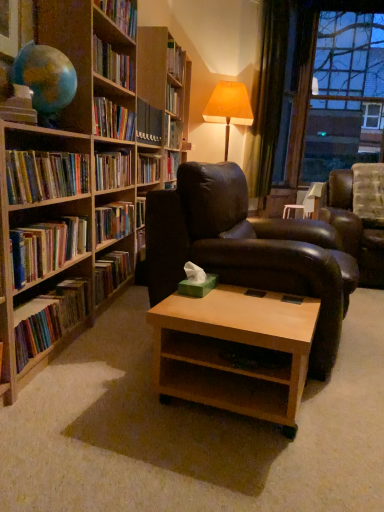
Question: From the image's perspective, is wooden bookshelf at center under hardcover books at left, which is the third book from bottom to top?

Choices:
 (A) no
 (B) yes

Answer: (A)

Question: Is wooden bookshelf at center oriented away from hardcover books at left, the 1th book when ordered from top to bottom?

Choices:
 (A) no
 (B) yes

Answer: (A)

Question: Is wooden bookshelf at center smaller than hardcover books at left, which is the third book from bottom to top?

Choices:
 (A) yes
 (B) no

Answer: (B)

Question: From the image's perspective, is wooden bookshelf at center located above hardcover books at left, which is the third book from bottom to top?

Choices:
 (A) yes
 (B) no

Answer: (A)

Question: Does wooden bookshelf at center appear on the right side of hardcover books at left, the 1th book when ordered from top to bottom?

Choices:
 (A) yes
 (B) no

Answer: (A)

Question: Is transparent glass window at upper right situated inside matte beige table lamp at upper right or outside?

Choices:
 (A) inside
 (B) outside

Answer: (B)

Question: Would you say transparent glass window at upper right is to the left or to the right of matte beige table lamp at upper right in the picture?

Choices:
 (A) right
 (B) left

Answer: (A)

Question: From a real-world perspective, relative to matte beige table lamp at upper right, is transparent glass window at upper right vertically above or below?

Choices:
 (A) above
 (B) below

Answer: (A)

Question: Is transparent glass window at upper right bigger or smaller than matte beige table lamp at upper right?

Choices:
 (A) small
 (B) big

Answer: (B)

Question: In terms of size, does light brown wood coffee table at center appear bigger or smaller than green velvet curtain at upper right?

Choices:
 (A) small
 (B) big

Answer: (A)

Question: Considering their positions, is light brown wood coffee table at center located in front of or behind green velvet curtain at upper right?

Choices:
 (A) front
 (B) behind

Answer: (A)

Question: Would you say light brown wood coffee table at center is to the left or to the right of green velvet curtain at upper right in the picture?

Choices:
 (A) left
 (B) right

Answer: (A)

Question: From the image's perspective, is light brown wood coffee table at center located above or below green velvet curtain at upper right?

Choices:
 (A) above
 (B) below

Answer: (B)

Question: Is wooden bookshelf at center bigger or smaller than green velvet curtain at upper right?

Choices:
 (A) big
 (B) small

Answer: (B)

Question: Is point (157, 163) positioned closer to the camera than point (278, 36)?

Choices:
 (A) closer
 (B) farther

Answer: (A)